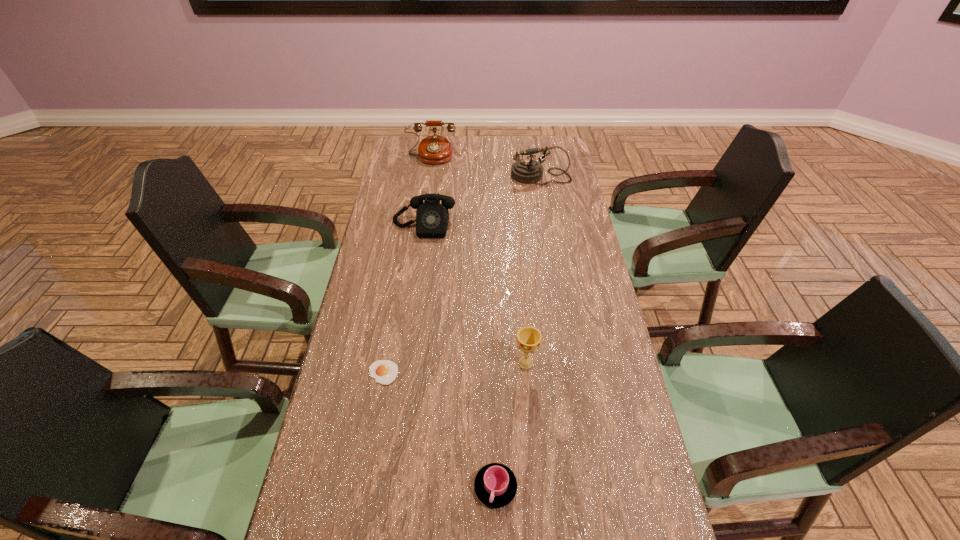
Where is `free spot located 0.090m on the left of the rightmost telephone`? This screenshot has height=540, width=960. free spot located 0.090m on the left of the rightmost telephone is located at coordinates (491, 176).

Locate an element on the screen. This screenshot has height=540, width=960. free space located 0.370m on the front of the chalice is located at coordinates (539, 516).

Find the location of a particular element. Image resolution: width=960 pixels, height=540 pixels. vacant point located on the dial of the fourth nearest object is located at coordinates (420, 258).

This screenshot has width=960, height=540. I want to click on free location located 0.050m on the side with the handle of the cup, so click(496, 535).

The height and width of the screenshot is (540, 960). In order to click on free region located 0.360m on the right of the shortest object in this screenshot , I will do (525, 373).

You are a GUI agent. You are given a task and a screenshot of the screen. Output one action in this format:
    pyautogui.click(x=<x>, y=<y>)
    Task: Click on the object present at the far edge
    The width and height of the screenshot is (960, 540).
    Given the screenshot: What is the action you would take?
    pyautogui.click(x=435, y=149)

Find the location of a particular element. The image size is (960, 540). egg yolk located at the left edge is located at coordinates (384, 372).

Where is `object that is at the right edge`? object that is at the right edge is located at coordinates (527, 171).

Identify the location of object at the far left corner. The height and width of the screenshot is (540, 960). (435, 149).

Find the location of a particular element. Image resolution: width=960 pixels, height=540 pixels. vacant region at the far edge is located at coordinates (475, 152).